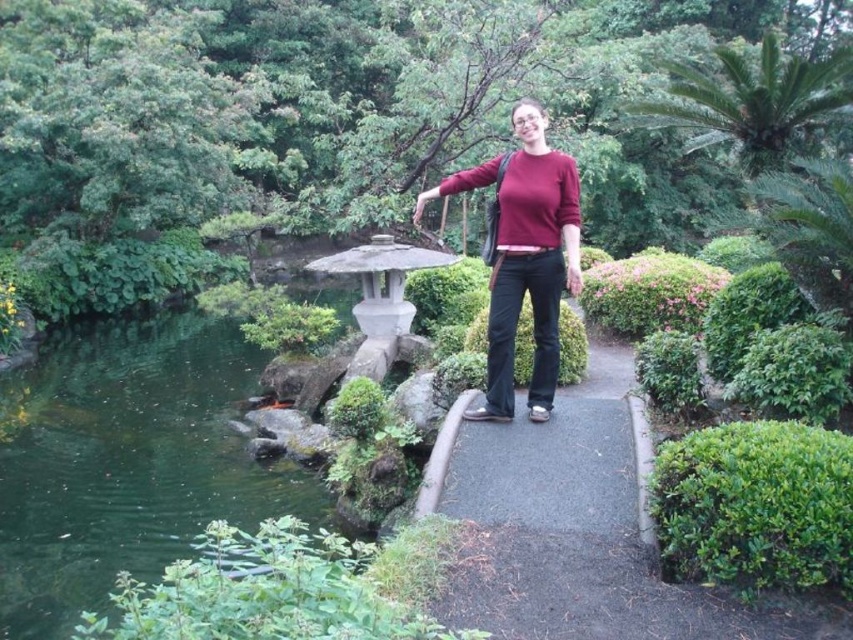
You are standing at the center of the garden and see the point marked at coordinates [126,461]. What is located at that point?

The point at coordinates [126,461] corresponds to green liquid water at lower left.

You are a photographer setting up a shot in the garden. You notice the green liquid water at lower left and the matte red sweater at center. Which object is positioned lower in the image?

The green liquid water at lower left is positioned lower in the image than the matte red sweater at center.

You are a photographer taking a picture of the garden scene. You notice the green liquid water at lower left and the matte red sweater at center. Which object is positioned closer to the camera?

The green liquid water at lower left is closer to the viewer than the matte red sweater at center, so the green liquid water at lower left would appear closer to the camera in the photograph.